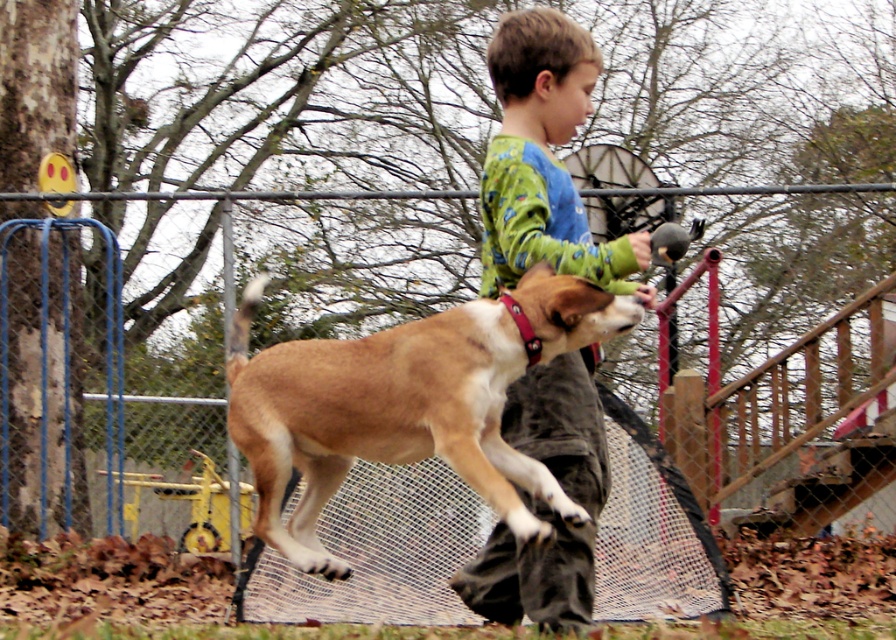
Question: Which object is positioned closest to the metal mesh fence at center?

Choices:
 (A) green/blue fleece shirt at center
 (B) brown fur dog at center

Answer: (A)

Question: In this image, where is brown fur dog at center located relative to green/blue fleece shirt at center?

Choices:
 (A) below
 (B) above

Answer: (A)

Question: Which of the following is the farthest from the observer?

Choices:
 (A) green/blue fleece shirt at center
 (B) metal mesh fence at center
 (C) brown fur dog at center

Answer: (B)

Question: Which object is farther from the camera taking this photo?

Choices:
 (A) metal mesh fence at center
 (B) brown fur dog at center

Answer: (A)

Question: Is green/blue fleece shirt at center below metal mesh fence at center?

Choices:
 (A) yes
 (B) no

Answer: (B)

Question: Does green/blue fleece shirt at center appear over metal mesh fence at center?

Choices:
 (A) yes
 (B) no

Answer: (A)